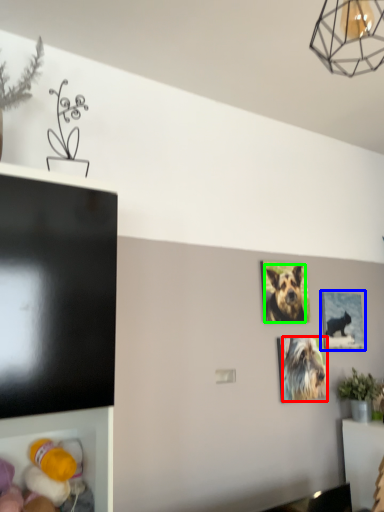
Question: Considering the real-world distances, which object is farthest from dog (highlighted by a red box)? picture frame (highlighted by a blue box) or dog (highlighted by a green box)?

Choices:
 (A) picture frame
 (B) dog

Answer: (A)